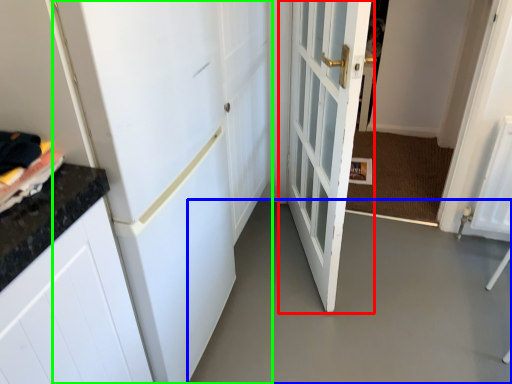
Question: Which object is positioned closest to door (highlighted by a red box)? Select from concrete (highlighted by a blue box) and door (highlighted by a green box).

Choices:
 (A) concrete
 (B) door

Answer: (B)